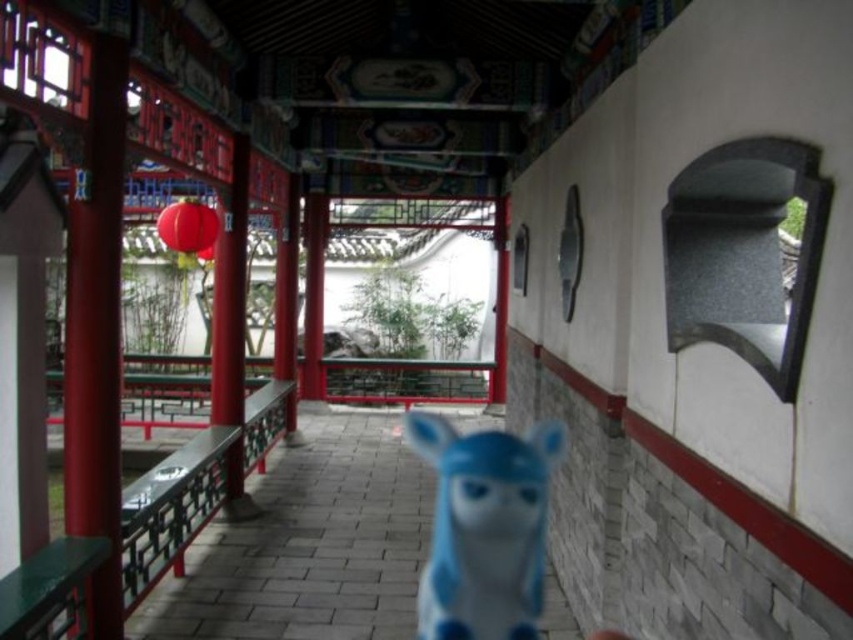
You are an architect examining the traditional Chinese corridor. You notice the smooth glossy red pillar at center left and the matte red paper lantern at upper left. Which object is taller?

A: The smooth glossy red pillar at center left is taller than the matte red paper lantern at upper left according to the description.

You are a visitor in this traditional Chinese corridor and want to place a new decorative item between the blue matte toy at center and the matte red paper lantern at upper left. Considering their sizes, which object should you place closer to the smaller one to maintain balance?

The blue matte toy at center is larger than the matte red paper lantern at upper left. To maintain balance, place the new decorative item closer to the smaller matte red paper lantern at upper left.

You are standing in the traditional Chinese corridor and want to hang a new decorative item. You notice the smooth glossy red pillar at center left and the matte red paper lantern at upper left. Which object is closer to you, and can you place a new item in between them?

The smooth glossy red pillar at center left is closer to you than the matte red paper lantern at upper left. Since the matte red paper lantern at upper left is behind the smooth glossy red pillar at center left, there is no space between them for placing a new item.